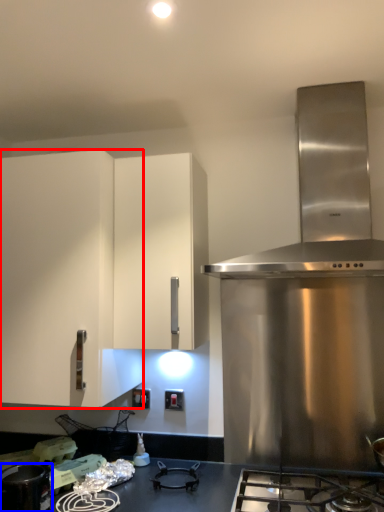
Question: Which point is further to the camera, cabinetry (highlighted by a red box) or kitchen appliance (highlighted by a blue box)?

Choices:
 (A) cabinetry
 (B) kitchen appliance

Answer: (A)